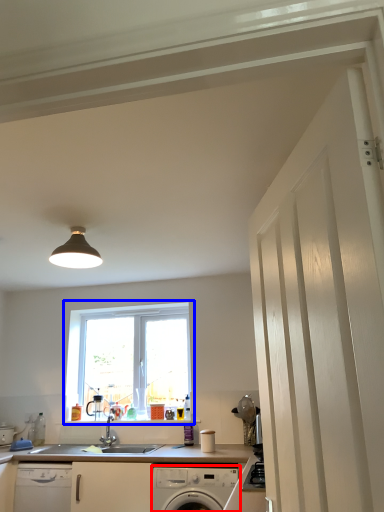
Question: Which object is further to the camera taking this photo, home appliance (highlighted by a red box) or window (highlighted by a blue box)?

Choices:
 (A) home appliance
 (B) window

Answer: (B)